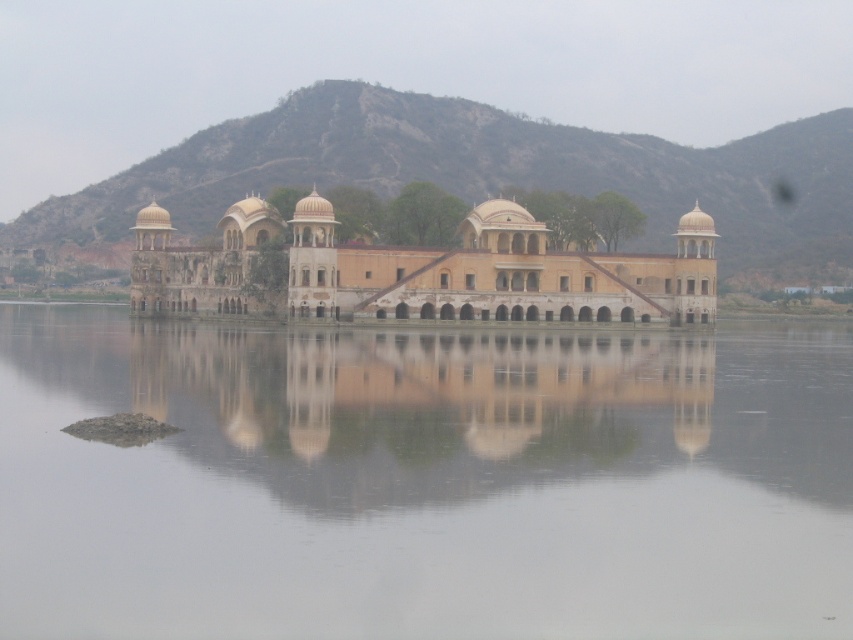
Does transparent water at center have a larger size compared to smooth sandstone palace at center?

Indeed, transparent water at center has a larger size compared to smooth sandstone palace at center.

Is transparent water at center to the right of smooth sandstone palace at center from the viewer's perspective?

Indeed, transparent water at center is positioned on the right side of smooth sandstone palace at center.

This screenshot has width=853, height=640. What are the coordinates of `transparent water at center` in the screenshot? It's located at (422, 481).

The height and width of the screenshot is (640, 853). I want to click on transparent water at center, so click(422, 481).

Does transparent water at center lie behind beige stone palace at center?

That is False.

Can you confirm if transparent water at center is shorter than beige stone palace at center?

Yes, transparent water at center is shorter than beige stone palace at center.

Is point (22, 502) farther from viewer compared to point (473, 209)?

No, (22, 502) is closer to viewer.

Locate an element on the screen. Image resolution: width=853 pixels, height=640 pixels. transparent water at center is located at coordinates (422, 481).

Between smooth sandstone palace at center and beige stone palace at center, which one is positioned higher?

beige stone palace at center

Between point (368, 461) and point (607, 321), which one is positioned in front?

Positioned in front is point (368, 461).

The width and height of the screenshot is (853, 640). I want to click on smooth sandstone palace at center, so click(421, 408).